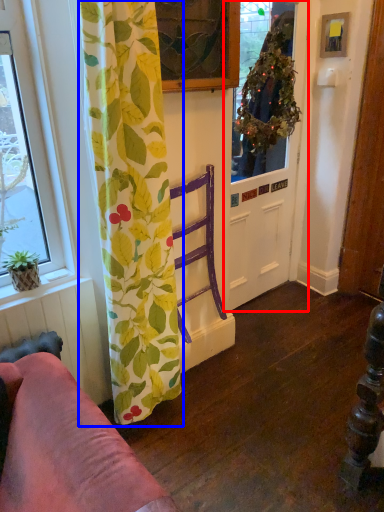
Question: Which object appears farthest to the camera in this image, door (highlighted by a red box) or curtain (highlighted by a blue box)?

Choices:
 (A) door
 (B) curtain

Answer: (A)